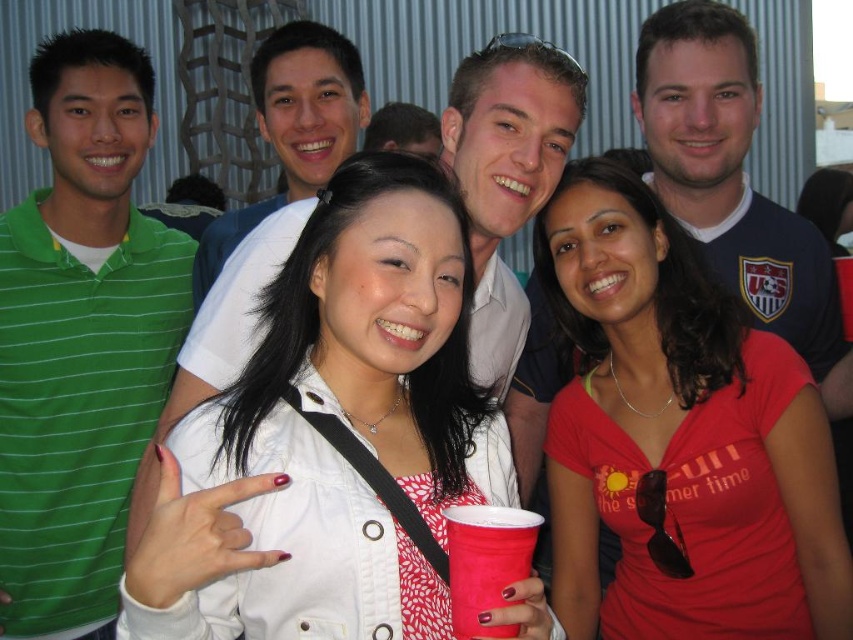
You are a photographer trying to capture a closeup of the matte plastic cup at center. You need to ensure that the matte white shirt at upper center doesn not block the view. Given their widths, can the cup be positioned to the side without overlapping?

The matte white shirt at upper center is wider than the matte plastic cup at center. Since the shirt is wider, positioning the cup to the side might still be possible as long as there is enough space around the shirt. However, the exact feasibility depends on the overall arrangement and distance between them, which isn not specified in the description.

You are standing at the origin of the coordinate system in the image. The point at coordinates point (292, 128) is where the matte white shirt at upper center is located. If you want to move towards the matte white shirt at upper center, which direction should you go?

The point at coordinates point (292, 128) indicates the location of the matte white shirt at upper center. Since the coordinate system places the origin at the bottom left corner, moving towards the upper center would require moving upwards and to the right from the origin.